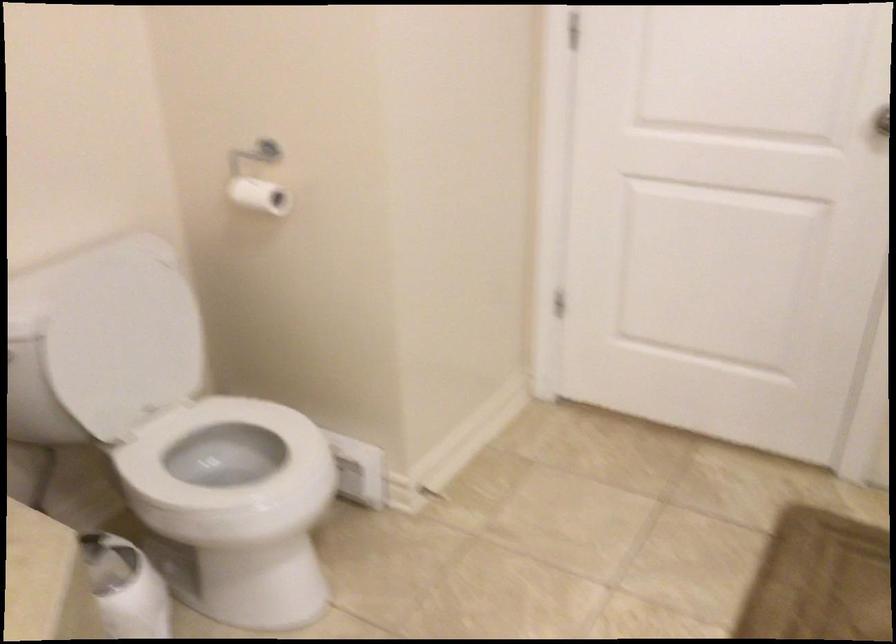
Image resolution: width=896 pixels, height=644 pixels. Identify the location of round door handle. pos(879,131).